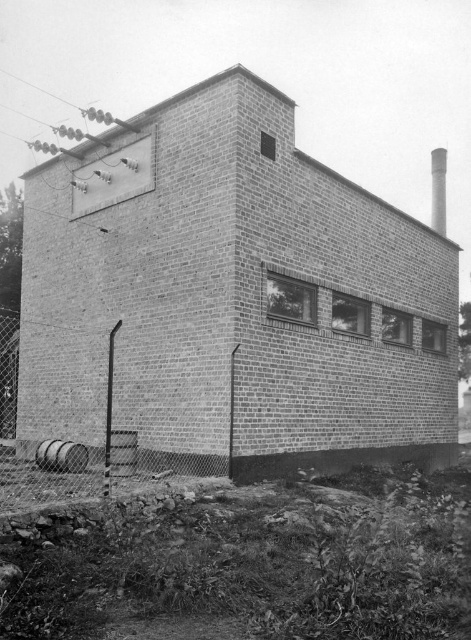
Based on the photo, is metal chain-link fence at lower left further to the viewer compared to white brick chimney at upper right?

No, it is in front of white brick chimney at upper right.

Who is more forward, [139,452] or [440,205]?

Point [139,452] is in front.

Locate an element on the screen. metal chain-link fence at lower left is located at coordinates (89, 464).